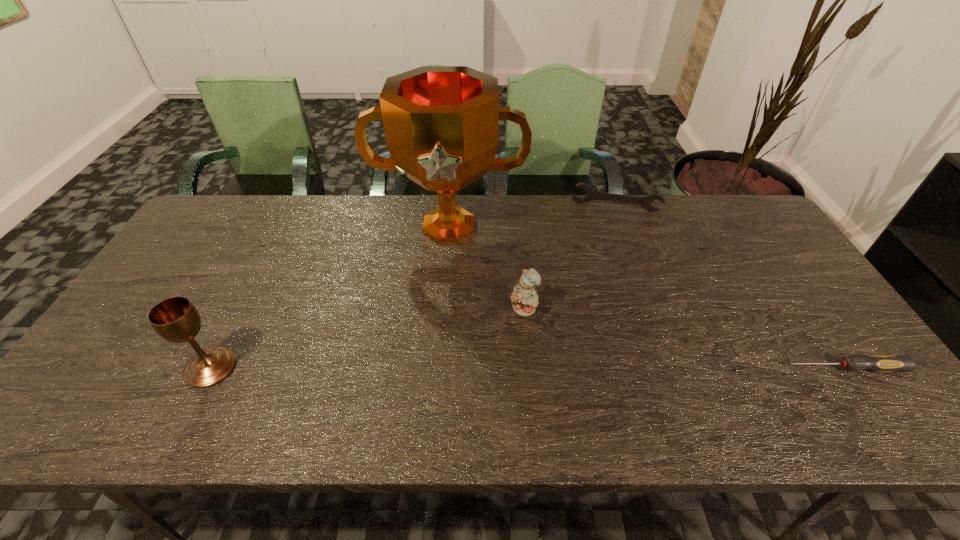
Identify the location of vacant region at the left edge of the desktop. The height and width of the screenshot is (540, 960). (119, 355).

Find the location of `free space at the right edge of the desktop`. free space at the right edge of the desktop is located at coordinates (777, 261).

Where is `vacant space at the far left corner of the desktop`? vacant space at the far left corner of the desktop is located at coordinates tap(222, 233).

Where is `free space at the near right corner`? The image size is (960, 540). free space at the near right corner is located at coordinates (870, 389).

Image resolution: width=960 pixels, height=540 pixels. What are the coordinates of `vacant space that is in between the teddy bear and the tallest object` in the screenshot? It's located at (486, 269).

You are a GUI agent. You are given a task and a screenshot of the screen. Output one action in this format:
    pyautogui.click(x=<x>, y=<y>)
    Task: Click on the free space between the chalice and the third nearest object
    The width and height of the screenshot is (960, 540).
    Given the screenshot: What is the action you would take?
    [x=367, y=339]

Locate an element on the screen. free space between the tallest object and the leftmost object is located at coordinates (330, 297).

Identify the location of empty space between the third shortest object and the screwdriver. This screenshot has height=540, width=960. (684, 339).

Where is `unoccupied position between the third nearest object and the tallest object`? unoccupied position between the third nearest object and the tallest object is located at coordinates (486, 269).

The image size is (960, 540). Find the location of `free spot between the second tallest object and the third shortest object`. free spot between the second tallest object and the third shortest object is located at coordinates (367, 339).